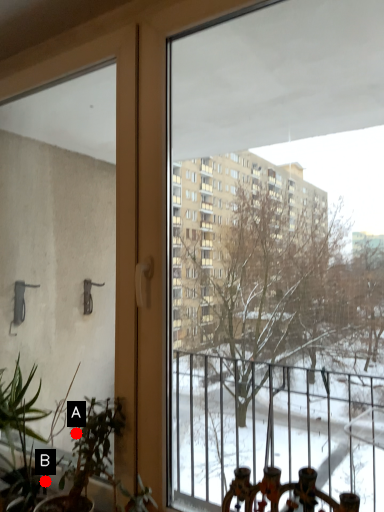
Question: Two points are circled on the image, labeled by A and B beside each circle. Which point is farther to the camera?

Choices:
 (A) A is further
 (B) B is further

Answer: (A)